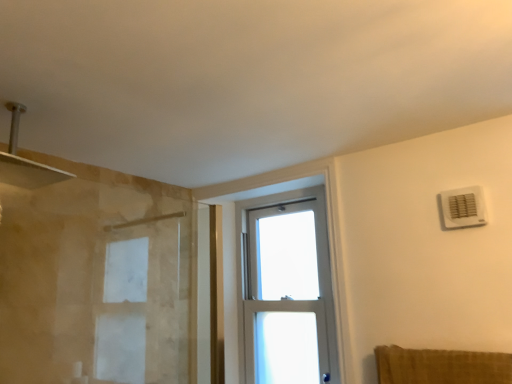
Question: Considering the positions of white plastic air conditioning unit at upper right and clear glass window at center in the image, is white plastic air conditioning unit at upper right wider or thinner than clear glass window at center?

Choices:
 (A) wide
 (B) thin

Answer: (B)

Question: From their relative heights in the image, would you say white plastic air conditioning unit at upper right is taller or shorter than clear glass window at center?

Choices:
 (A) short
 (B) tall

Answer: (A)

Question: Considering the positions of white plastic air conditioning unit at upper right and clear glass window at center in the image, is white plastic air conditioning unit at upper right bigger or smaller than clear glass window at center?

Choices:
 (A) small
 (B) big

Answer: (A)

Question: Based on their sizes in the image, would you say clear glass window at center is bigger or smaller than white plastic air conditioning unit at upper right?

Choices:
 (A) small
 (B) big

Answer: (B)

Question: From a real-world perspective, is clear glass window at center physically located above or below white plastic air conditioning unit at upper right?

Choices:
 (A) above
 (B) below

Answer: (B)

Question: Do you think clear glass window at center is within white plastic air conditioning unit at upper right, or outside of it?

Choices:
 (A) outside
 (B) inside

Answer: (A)

Question: From the image's perspective, is clear glass window at center positioned above or below white plastic air conditioning unit at upper right?

Choices:
 (A) above
 (B) below

Answer: (B)